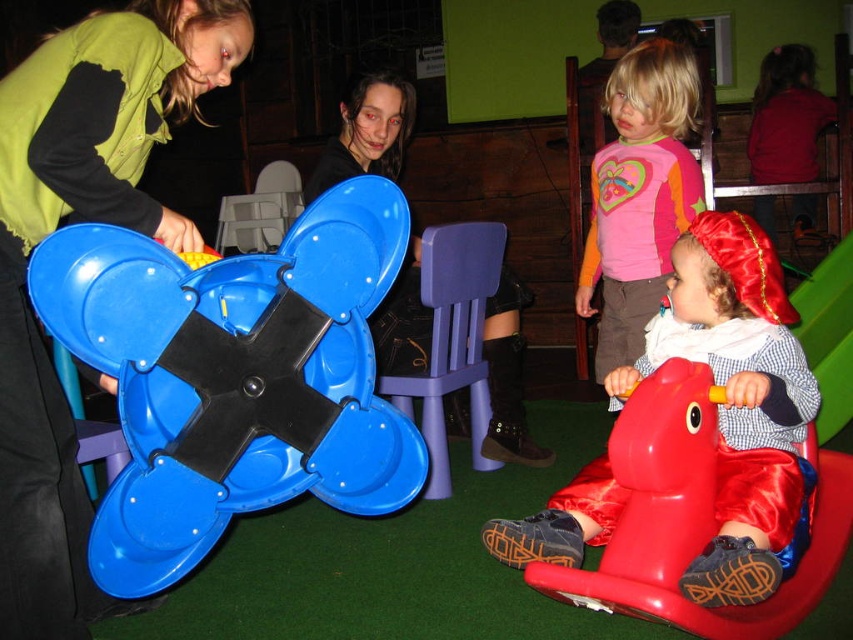
Does green matte vest at upper left appear over pink fabric shirt at upper center?

Actually, green matte vest at upper left is below pink fabric shirt at upper center.

Is green matte vest at upper left to the left of pink fabric shirt at upper center from the viewer's perspective?

Indeed, green matte vest at upper left is positioned on the left side of pink fabric shirt at upper center.

Between point (45, 58) and point (602, 157), which one is positioned in front?

Point (45, 58)

At what (x,y) coordinates should I click in order to perform the action: click on green matte vest at upper left. Please return your answer as a coordinate pair (x, y). This screenshot has height=640, width=853. Looking at the image, I should click on (80, 220).

The image size is (853, 640). What do you see at coordinates (692, 516) in the screenshot? I see `rubberized plastic rocking horse at lower right` at bounding box center [692, 516].

This screenshot has width=853, height=640. What are the coordinates of `rubberized plastic rocking horse at lower right` in the screenshot? It's located at (692, 516).

Does green matte vest at upper left lie in front of shiny red costume at lower right?

Yes, green matte vest at upper left is in front of shiny red costume at lower right.

Is green matte vest at upper left above shiny red costume at lower right?

Indeed, green matte vest at upper left is positioned over shiny red costume at lower right.

Between point (193, 58) and point (766, 387), which one is positioned in front?

Point (766, 387) is more forward.

Image resolution: width=853 pixels, height=640 pixels. In order to click on green matte vest at upper left in this screenshot , I will do `click(80, 220)`.